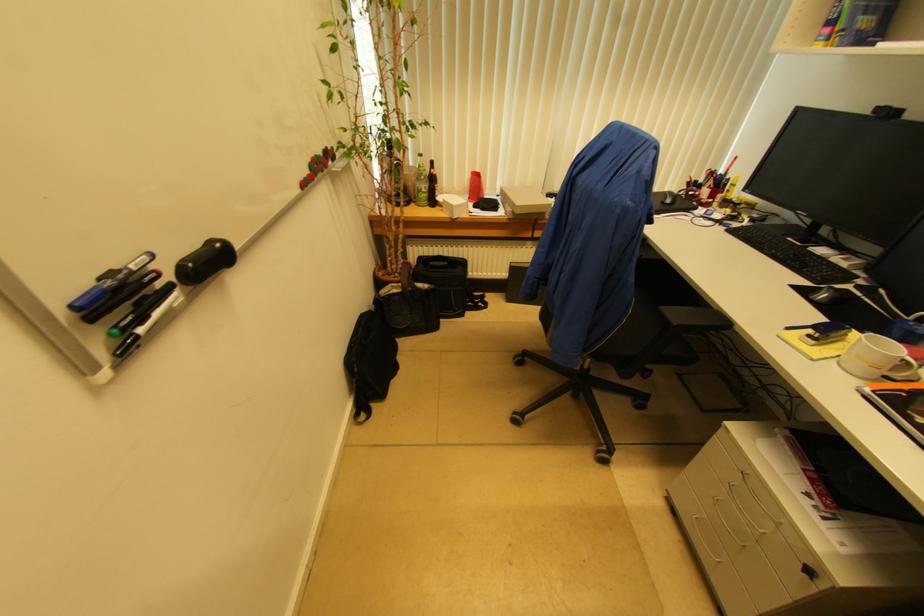
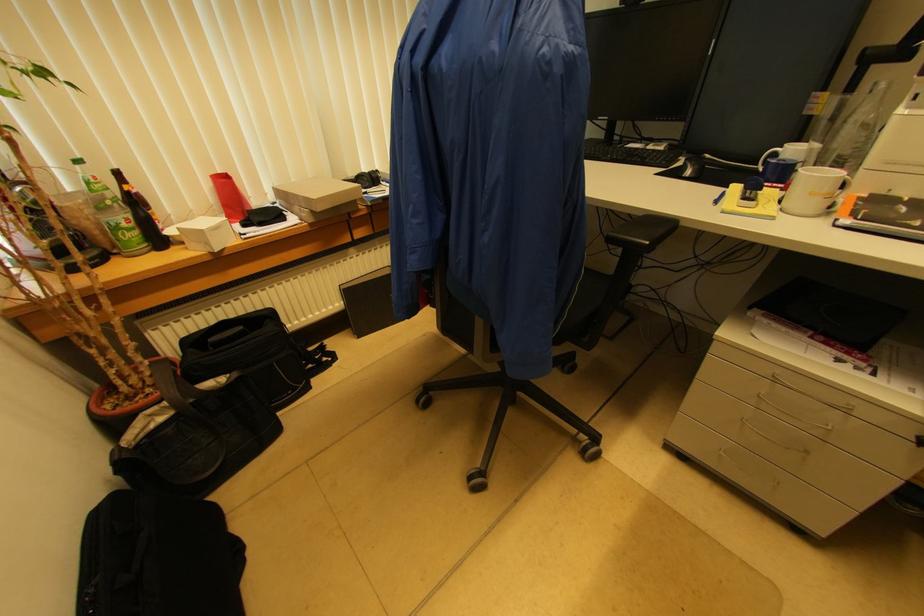
Locate, in the second image, the point that corresponds to (x=433, y=164) in the first image.

(118, 176)